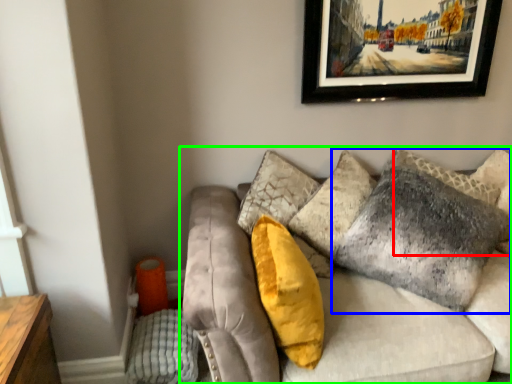
Question: Estimate the real-world distances between objects in this image. Which object is farther from pillow (highlighted by a red box), pillow (highlighted by a blue box) or studio couch (highlighted by a green box)?

Choices:
 (A) pillow
 (B) studio couch

Answer: (B)